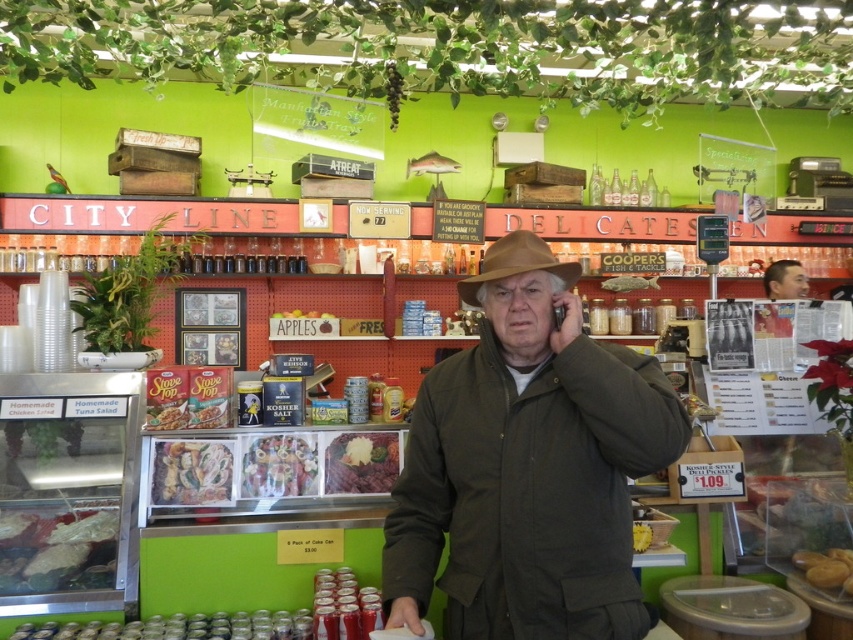
Is point (201, 458) in front of point (343, 477)?

Yes, it is in front of point (343, 477).

Is shiny plastic deli meat at center below brown matte meat at center?

Indeed, shiny plastic deli meat at center is positioned under brown matte meat at center.

Does point (177, 497) lie in front of point (381, 486)?

Yes, point (177, 497) is closer to viewer.

Find the location of a particular element. The image size is (853, 640). shiny plastic deli meat at center is located at coordinates (190, 472).

Looking at this image, can you confirm if matte plastic slope top at center is smaller than yellow crumbly pastry at center?

No.

Between point (216, 410) and point (634, 536), which one is positioned in front?

Point (634, 536) is in front.

Locate an element on the screen. The image size is (853, 640). matte plastic slope top at center is located at coordinates (187, 413).

How far apart are dark brown corduroy jacket at center and yellow matte bread at lower right?

3.64 feet

Between dark brown corduroy jacket at center and yellow matte bread at lower right, which one is positioned higher?

dark brown corduroy jacket at center is above.

What do you see at coordinates (527, 467) in the screenshot? I see `dark brown corduroy jacket at center` at bounding box center [527, 467].

The width and height of the screenshot is (853, 640). I want to click on dark brown corduroy jacket at center, so click(527, 467).